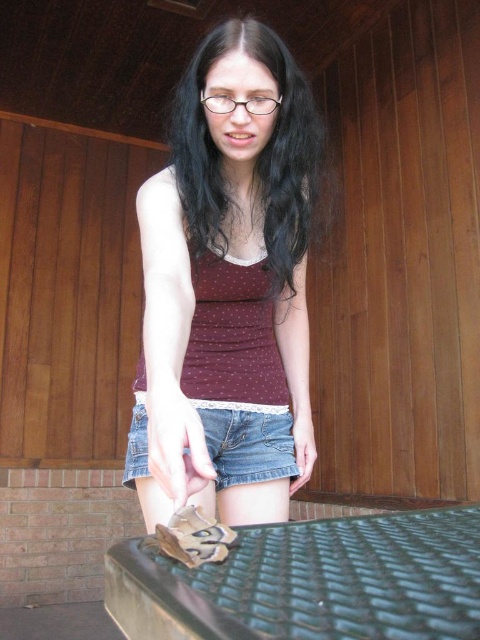
Consider the image. Can you confirm if matte burgundy tank top at center is positioned below pale skin at center?

No, matte burgundy tank top at center is not below pale skin at center.

Does matte burgundy tank top at center appear on the right side of pale skin at center?

Incorrect, matte burgundy tank top at center is not on the right side of pale skin at center.

Between point (261, 509) and point (181, 396), which one is positioned in front?

Positioned in front is point (181, 396).

Locate an element on the screen. The image size is (480, 640). matte burgundy tank top at center is located at coordinates (226, 282).

Who is positioned more to the right, pale skin at center or matte brown leather hand at lower center?

From the viewer's perspective, matte brown leather hand at lower center appears more on the right side.

Does pale skin at center appear on the left side of matte brown leather hand at lower center?

Correct, you'll find pale skin at center to the left of matte brown leather hand at lower center.

You are a GUI agent. You are given a task and a screenshot of the screen. Output one action in this format:
    pyautogui.click(x=<x>, y=<y>)
    Task: Click on the pale skin at center
    The height and width of the screenshot is (640, 480).
    Given the screenshot: What is the action you would take?
    pyautogui.click(x=177, y=445)

I want to click on pale skin at center, so click(x=177, y=445).

Between black wavy hair at center and pale skin at center, which one has more height?

Standing taller between the two is black wavy hair at center.

Does black wavy hair at center have a lesser width compared to pale skin at center?

Incorrect, black wavy hair at center's width is not less than pale skin at center's.

Between point (192, 60) and point (168, 442), which one is positioned in front?

Positioned in front is point (168, 442).

The height and width of the screenshot is (640, 480). I want to click on black wavy hair at center, so click(254, 152).